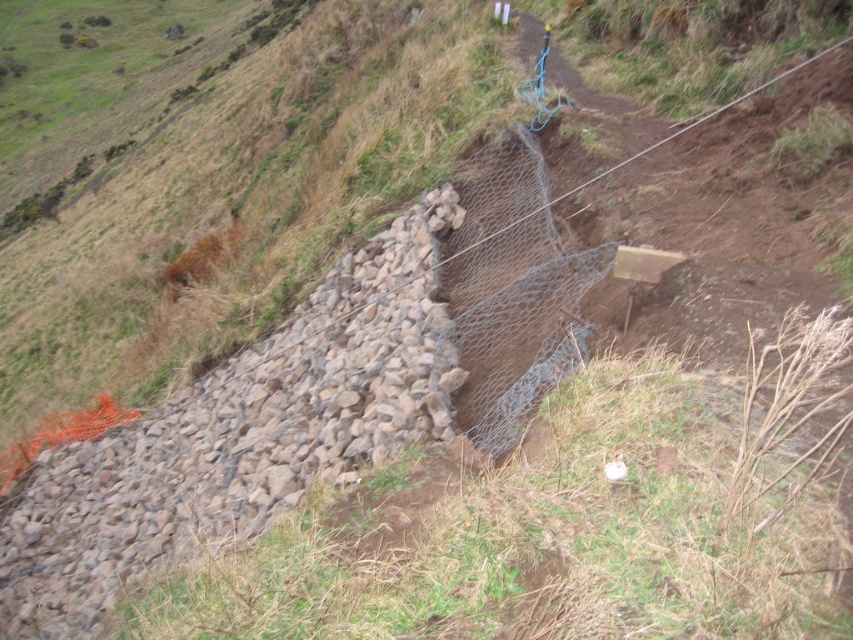
How far apart are wire mesh at center and wire mesh fence at center?

wire mesh at center and wire mesh fence at center are 1.55 meters apart.

The image size is (853, 640). What do you see at coordinates (512, 291) in the screenshot?
I see `wire mesh at center` at bounding box center [512, 291].

Find the location of a particular element. The width and height of the screenshot is (853, 640). wire mesh at center is located at coordinates (512, 291).